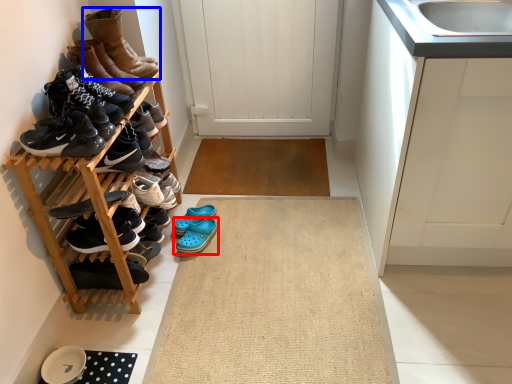
Question: Among these objects, which one is farthest to the camera, footwear (highlighted by a red box) or footwear (highlighted by a blue box)?

Choices:
 (A) footwear
 (B) footwear

Answer: (A)